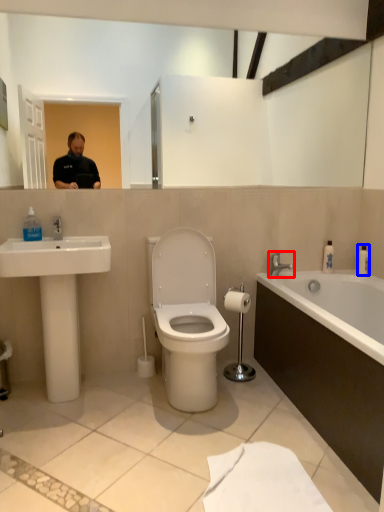
Question: Which point is further to the camera, tap (highlighted by a red box) or toiletry (highlighted by a blue box)?

Choices:
 (A) tap
 (B) toiletry

Answer: (B)